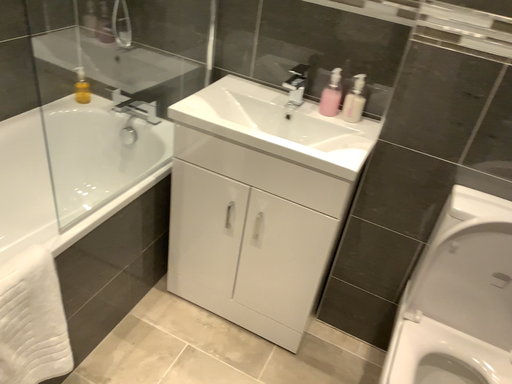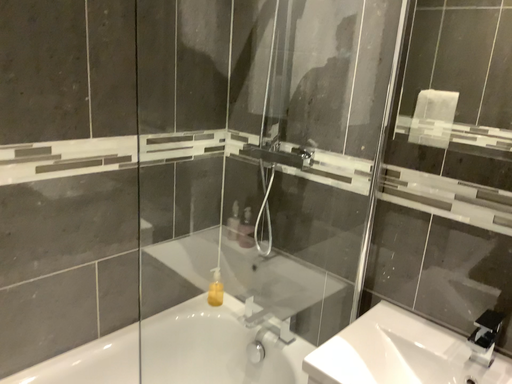
Question: How did the camera likely rotate when shooting the video?

Choices:
 (A) rotated downward
 (B) rotated upward

Answer: (B)